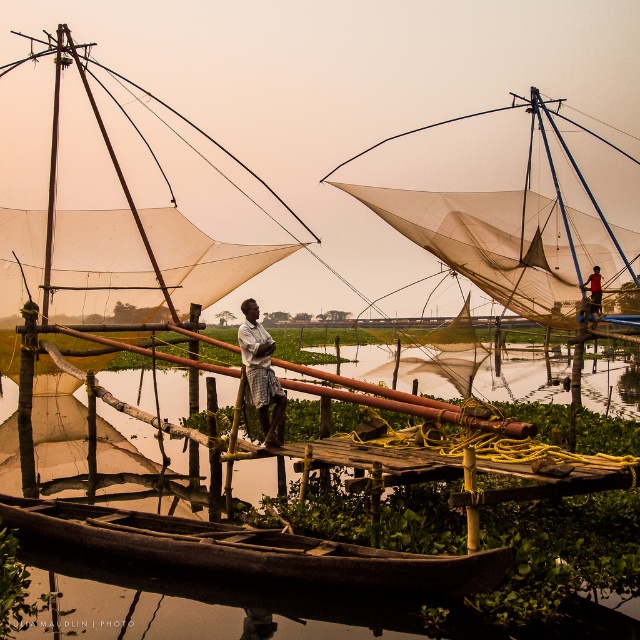
Is brown wooden waterway at center closer to the viewer compared to dark brown wooden canoe at lower center?

Yes, it is in front of dark brown wooden canoe at lower center.

Based on the photo, is brown wooden waterway at center above dark brown wooden canoe at lower center?

No, brown wooden waterway at center is not above dark brown wooden canoe at lower center.

Is point (348, 621) behind point (100, 508)?

No, (348, 621) is in front of (100, 508).

You are a GUI agent. You are given a task and a screenshot of the screen. Output one action in this format:
    pyautogui.click(x=<x>, y=<y>)
    Task: Click on the brown wooden waterway at center
    
    Given the screenshot: What is the action you would take?
    pyautogui.click(x=252, y=564)

Consider the image. Does brown wooden waterway at center have a larger size compared to orange fabric fisherman at right?

Yes, brown wooden waterway at center is bigger than orange fabric fisherman at right.

Can you confirm if brown wooden waterway at center is positioned to the right of orange fabric fisherman at right?

Incorrect, brown wooden waterway at center is not on the right side of orange fabric fisherman at right.

Which is in front, point (122, 522) or point (595, 278)?

Point (122, 522)

The height and width of the screenshot is (640, 640). In order to click on brown wooden waterway at center in this screenshot , I will do `click(252, 564)`.

Is dark brown wooden canoe at lower center to the left of orange fabric fisherman at right from the viewer's perspective?

Indeed, dark brown wooden canoe at lower center is positioned on the left side of orange fabric fisherman at right.

Is point (186, 544) positioned in front of point (589, 275)?

Yes.

Locate an element on the screen. dark brown wooden canoe at lower center is located at coordinates (246, 550).

This screenshot has width=640, height=640. I want to click on dark brown wooden canoe at lower center, so click(246, 550).